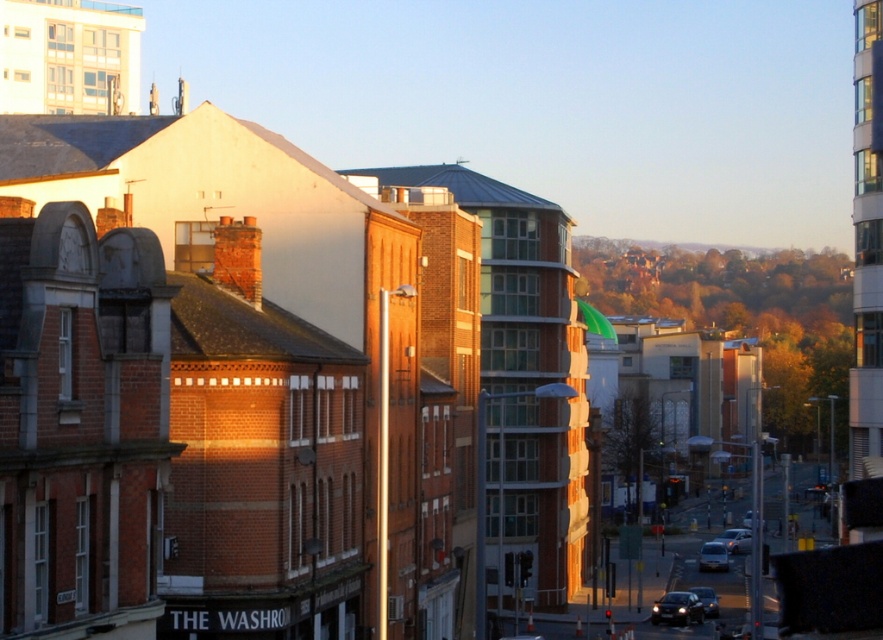
Does shiny black car at lower right have a greater height compared to shiny silver sedan at center?

Incorrect, shiny black car at lower right's height is not larger of shiny silver sedan at center's.

Between shiny black car at lower right and shiny silver sedan at center, which one has more height?

shiny silver sedan at center

Identify the location of shiny black car at lower right. The image size is (883, 640). (677, 609).

Is metallic silver car at center to the right of shiny black sedan at lower right from the viewer's perspective?

Indeed, metallic silver car at center is positioned on the right side of shiny black sedan at lower right.

Describe the element at coordinates (736, 540) in the screenshot. I see `metallic silver car at center` at that location.

At what (x,y) coordinates should I click in order to perform the action: click on metallic silver car at center. Please return your answer as a coordinate pair (x, y). The image size is (883, 640). Looking at the image, I should click on (736, 540).

Looking at this image, is shiny silver sedan at center above metallic silver car at center?

Correct, shiny silver sedan at center is located above metallic silver car at center.

Does shiny silver sedan at center have a lesser height compared to metallic silver car at center?

Incorrect, shiny silver sedan at center's height does not fall short of metallic silver car at center's.

Between point (702, 561) and point (736, 548), which one is positioned in front?

Positioned in front is point (702, 561).

At what (x,y) coordinates should I click in order to perform the action: click on shiny silver sedan at center. Please return your answer as a coordinate pair (x, y). This screenshot has width=883, height=640. Looking at the image, I should click on (713, 556).